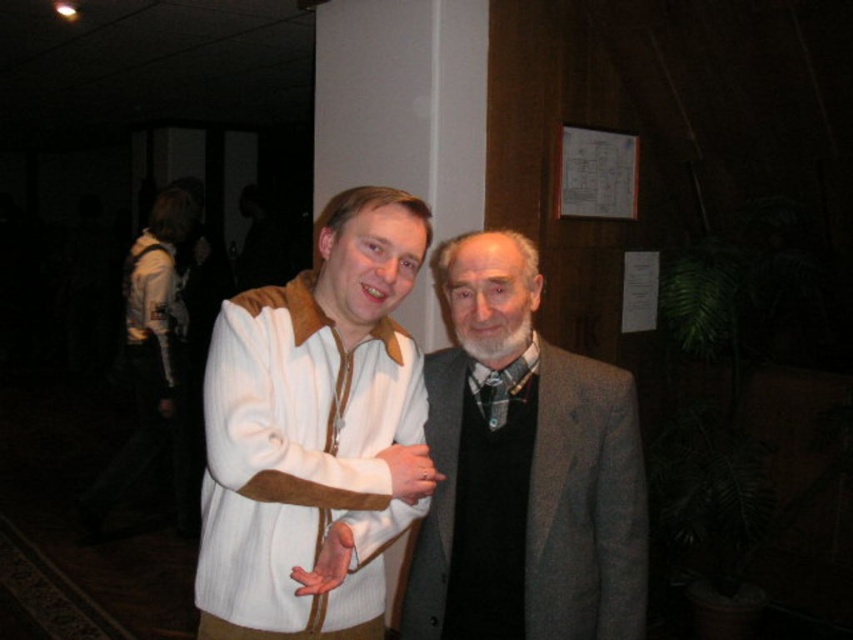
Question: From the image, what is the correct spatial relationship of white textured sweater at center in relation to black wool dress at center?

Choices:
 (A) right
 (B) left

Answer: (B)

Question: Can you confirm if white textured sweater at center is bigger than gray wool suit at center?

Choices:
 (A) yes
 (B) no

Answer: (A)

Question: Based on their relative distances, which object is nearer to the gray wool suit at center?

Choices:
 (A) white textured sweater at center
 (B) black wool dress at center

Answer: (B)

Question: Does gray wool suit at center appear on the right side of black wool dress at center?

Choices:
 (A) yes
 (B) no

Answer: (A)

Question: Considering the real-world distances, which object is closest to the black wool dress at center?

Choices:
 (A) white textured sweater at center
 (B) gray wool suit at center

Answer: (B)

Question: Which of the following is the closest to the observer?

Choices:
 (A) pos(584,561)
 (B) pos(419,248)

Answer: (B)